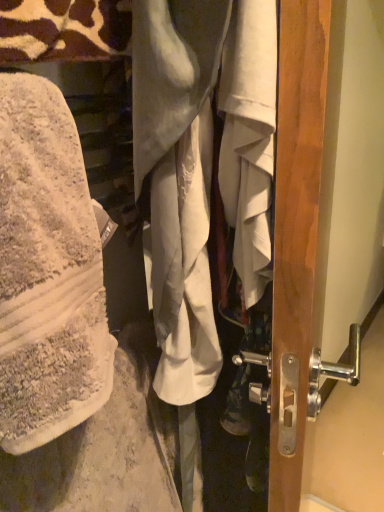
Describe the element at coordinates (202, 166) in the screenshot. I see `white cotton shirt at center, the first wrap positioned from the right` at that location.

This screenshot has height=512, width=384. What are the coordinates of `white cotton shirt at center, placed as the second wrap when sorted from left to right` in the screenshot? It's located at (202, 166).

Image resolution: width=384 pixels, height=512 pixels. Describe the element at coordinates (199, 167) in the screenshot. I see `white cotton wrap at left, which is the 2th wrap from right to left` at that location.

Find the location of a particular element. The image size is (384, 512). white cotton wrap at left, which is the 2th wrap from right to left is located at coordinates (199, 167).

Find the location of `white cotton shirt at center, placed as the second wrap when sorted from left to right`. white cotton shirt at center, placed as the second wrap when sorted from left to right is located at coordinates (202, 166).

Which object is positioned more to the left, white cotton wrap at left, which appears as the first wrap when viewed from the left, or white cotton shirt at center, the first wrap positioned from the right?

Positioned to the left is white cotton wrap at left, which appears as the first wrap when viewed from the left.

Considering their positions, is white cotton wrap at left, which appears as the first wrap when viewed from the left, located in front of or behind white cotton shirt at center, the first wrap positioned from the right?

In the image, white cotton wrap at left, which appears as the first wrap when viewed from the left, appears in front of white cotton shirt at center, the first wrap positioned from the right.

Considering the points (168, 87) and (268, 118), which point is in front, point (168, 87) or point (268, 118)?

Point (268, 118)

From the image's perspective, which one is positioned lower, white cotton wrap at left, which appears as the first wrap when viewed from the left, or white cotton shirt at center, placed as the second wrap when sorted from left to right?

From the image's view, white cotton wrap at left, which appears as the first wrap when viewed from the left, is below.

From a real-world perspective, between white cotton wrap at left, which appears as the first wrap when viewed from the left, and white cotton shirt at center, the first wrap positioned from the right, who is vertically lower?

white cotton shirt at center, the first wrap positioned from the right, from a real-world perspective.

Is white cotton wrap at left, which is the 2th wrap from right to left, wider or thinner than white cotton shirt at center, placed as the second wrap when sorted from left to right?

white cotton wrap at left, which is the 2th wrap from right to left, is wider than white cotton shirt at center, placed as the second wrap when sorted from left to right.

In the scene shown: Who is taller, white cotton wrap at left, which is the 2th wrap from right to left, or white cotton shirt at center, placed as the second wrap when sorted from left to right?

Standing taller between the two is white cotton shirt at center, placed as the second wrap when sorted from left to right.

Is white cotton wrap at left, which is the 2th wrap from right to left, smaller than white cotton shirt at center, placed as the second wrap when sorted from left to right?

Yes.

From the picture: Is white cotton shirt at center, the first wrap positioned from the right, surrounded by white cotton wrap at left, which is the 2th wrap from right to left?

Actually, white cotton shirt at center, the first wrap positioned from the right, is outside white cotton wrap at left, which is the 2th wrap from right to left.

Would you consider white cotton wrap at left, which appears as the first wrap when viewed from the left, to be distant from white cotton shirt at center, placed as the second wrap when sorted from left to right?

That's not correct — white cotton wrap at left, which appears as the first wrap when viewed from the left, is a little close to white cotton shirt at center, placed as the second wrap when sorted from left to right.

From the picture: Is white cotton wrap at left, which is the 2th wrap from right to left, oriented away from white cotton shirt at center, placed as the second wrap when sorted from left to right?

No.

In the scene shown: How different are the orientations of white cotton wrap at left, which is the 2th wrap from right to left, and white cotton shirt at center, placed as the second wrap when sorted from left to right, in degrees?

153 degrees separate the facing orientations of white cotton wrap at left, which is the 2th wrap from right to left, and white cotton shirt at center, placed as the second wrap when sorted from left to right.

How far apart are white cotton wrap at left, which appears as the first wrap when viewed from the left, and white cotton shirt at center, the first wrap positioned from the right?

white cotton wrap at left, which appears as the first wrap when viewed from the left, and white cotton shirt at center, the first wrap positioned from the right, are 0.62 inches apart from each other.

Identify the location of wrap that is in front of the white cotton shirt at center, the first wrap positioned from the right. (199, 167).

Considering the relative positions of white cotton shirt at center, the first wrap positioned from the right, and white cotton wrap at left, which is the 2th wrap from right to left, in the image provided, is white cotton shirt at center, the first wrap positioned from the right, to the left of white cotton wrap at left, which is the 2th wrap from right to left, from the viewer's perspective?

Incorrect, white cotton shirt at center, the first wrap positioned from the right, is not on the left side of white cotton wrap at left, which is the 2th wrap from right to left.

From the picture: Between white cotton shirt at center, placed as the second wrap when sorted from left to right, and white cotton wrap at left, which is the 2th wrap from right to left, which one is positioned behind?

Positioned behind is white cotton shirt at center, placed as the second wrap when sorted from left to right.

Does point (214, 369) come in front of point (154, 123)?

No.

From the image's perspective, relative to white cotton wrap at left, which appears as the first wrap when viewed from the left, is white cotton shirt at center, the first wrap positioned from the right, above or below?

Based on their image positions, white cotton shirt at center, the first wrap positioned from the right, is located above white cotton wrap at left, which appears as the first wrap when viewed from the left.

From a real-world perspective, between white cotton shirt at center, placed as the second wrap when sorted from left to right, and white cotton wrap at left, which appears as the first wrap when viewed from the left, who is vertically lower?

white cotton shirt at center, placed as the second wrap when sorted from left to right, is physically lower.

In the scene shown: Which of these two, white cotton shirt at center, placed as the second wrap when sorted from left to right, or white cotton wrap at left, which is the 2th wrap from right to left, is wider?

white cotton wrap at left, which is the 2th wrap from right to left, is wider.

Considering the sizes of white cotton shirt at center, the first wrap positioned from the right, and white cotton wrap at left, which is the 2th wrap from right to left, in the image, is white cotton shirt at center, the first wrap positioned from the right, taller or shorter than white cotton wrap at left, which is the 2th wrap from right to left,?

Clearly, white cotton shirt at center, the first wrap positioned from the right, is taller compared to white cotton wrap at left, which is the 2th wrap from right to left.

Considering the relative sizes of white cotton shirt at center, the first wrap positioned from the right, and white cotton wrap at left, which appears as the first wrap when viewed from the left, in the image provided, is white cotton shirt at center, the first wrap positioned from the right, bigger than white cotton wrap at left, which appears as the first wrap when viewed from the left,?

Indeed, white cotton shirt at center, the first wrap positioned from the right, has a larger size compared to white cotton wrap at left, which appears as the first wrap when viewed from the left.

Is white cotton wrap at left, which appears as the first wrap when viewed from the left, located within white cotton shirt at center, placed as the second wrap when sorted from left to right?

No, white cotton wrap at left, which appears as the first wrap when viewed from the left, is not inside white cotton shirt at center, placed as the second wrap when sorted from left to right.

Is white cotton shirt at center, the first wrap positioned from the right, directly adjacent to white cotton wrap at left, which appears as the first wrap when viewed from the left?

Yes, white cotton shirt at center, the first wrap positioned from the right, is with white cotton wrap at left, which appears as the first wrap when viewed from the left.

Could you tell me if white cotton shirt at center, the first wrap positioned from the right, is turned towards white cotton wrap at left, which is the 2th wrap from right to left?

No, white cotton shirt at center, the first wrap positioned from the right, does not turn towards white cotton wrap at left, which is the 2th wrap from right to left.

What's the angular difference between white cotton shirt at center, the first wrap positioned from the right, and white cotton wrap at left, which appears as the first wrap when viewed from the left,'s facing directions?

153 degrees.

Where is `wrap on the left of white cotton shirt at center, the first wrap positioned from the right`? wrap on the left of white cotton shirt at center, the first wrap positioned from the right is located at coordinates (199, 167).

You are a GUI agent. You are given a task and a screenshot of the screen. Output one action in this format:
    pyautogui.click(x=<x>, y=<y>)
    Task: Click on the wrap lying below the white cotton shirt at center, the first wrap positioned from the right (from the image's perspective)
    
    Given the screenshot: What is the action you would take?
    pyautogui.click(x=199, y=167)

There is a white cotton shirt at center, the first wrap positioned from the right. Where is `wrap above it (from a real-world perspective)`? Image resolution: width=384 pixels, height=512 pixels. wrap above it (from a real-world perspective) is located at coordinates (199, 167).